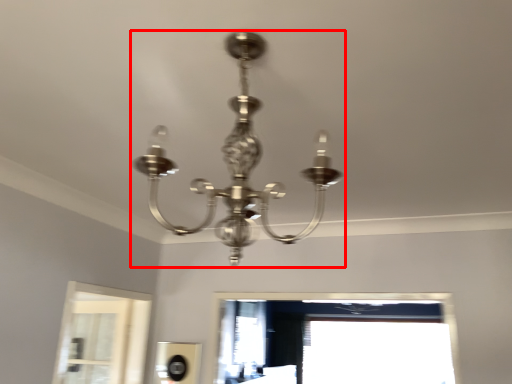
Question: From the image's perspective, considering the relative positions of lamp (annotated by the red box) and window in the image provided, where is lamp (annotated by the red box) located with respect to the staircase?

Choices:
 (A) below
 (B) above

Answer: (B)